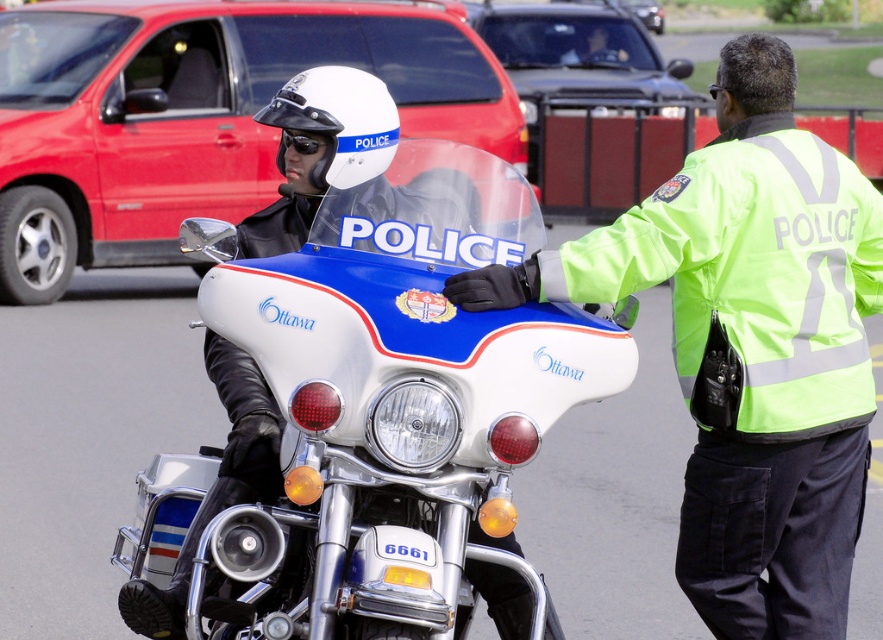
Question: Which point is closer to the camera?

Choices:
 (A) neon green reflective jacket at right
 (B) white glossy police motorcycle at center

Answer: (B)

Question: Can you confirm if white glossy police motorcycle at center is smaller than neon green reflective jacket at right?

Choices:
 (A) yes
 (B) no

Answer: (B)

Question: Is white glossy police motorcycle at center to the right of neon green reflective jacket at right from the viewer's perspective?

Choices:
 (A) yes
 (B) no

Answer: (B)

Question: Is white glossy police motorcycle at center to the right of neon green reflective jacket at right from the viewer's perspective?

Choices:
 (A) yes
 (B) no

Answer: (B)